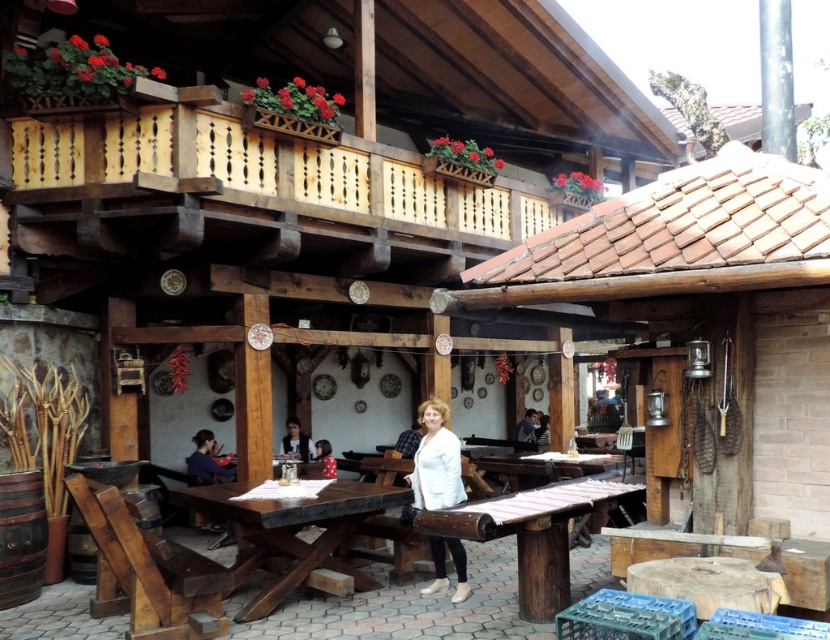
Question: Which object appears farthest from the camera in this image?

Choices:
 (A) light brown wooden chair at center
 (B) smooth brown hair at center
 (C) dark blue shirt at lower left

Answer: (B)

Question: Does wooden table at center appear under white matte jacket at center?

Choices:
 (A) yes
 (B) no

Answer: (A)

Question: Which point is closer to the camera?

Choices:
 (A) smooth brown hair at center
 (B) rustic wooden table at center
 (C) light brown wooden balcony at upper left

Answer: (B)

Question: Where is smooth brown hair at center located in relation to light brown wooden chair at center in the image?

Choices:
 (A) left
 (B) right

Answer: (A)

Question: Can you confirm if rustic wooden table at center is thinner than white fabric at center?

Choices:
 (A) no
 (B) yes

Answer: (A)

Question: Estimate the real-world distances between objects in this image. Which object is farther from the wooden table at center?

Choices:
 (A) light brown wooden balcony at upper left
 (B) rustic wooden table at center
 (C) white fabric at center

Answer: (C)